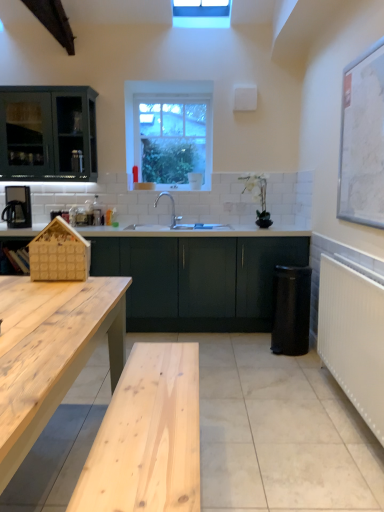
Where is `vacant area situated below white textured radiator at right (from a real-world perspective)`? vacant area situated below white textured radiator at right (from a real-world perspective) is located at coordinates (350, 411).